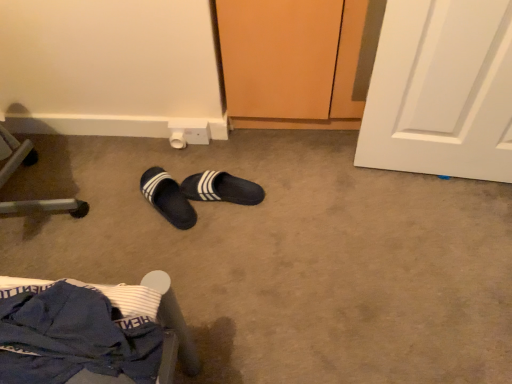
The width and height of the screenshot is (512, 384). Identify the location of blue fabric chair at lower left. (159, 320).

What do you see at coordinates (167, 198) in the screenshot? This screenshot has width=512, height=384. I see `black fuzzy slippers at center, the 2th footwear when ordered from right to left` at bounding box center [167, 198].

How much space does black fabric slippers at center, the 2th footwear in the left-to-right sequence, occupy horizontally?

12.10 inches.

I want to click on blue fabric chair at lower left, so click(159, 320).

Between blue fabric chair at lower left and black fuzzy slippers at center, which is counted as the first footwear, starting from the left, which one is positioned in front?

blue fabric chair at lower left is more forward.

Is blue fabric chair at lower left positioned with its back to black fuzzy slippers at center, the 2th footwear when ordered from right to left?

blue fabric chair at lower left does not have its back to black fuzzy slippers at center, the 2th footwear when ordered from right to left.

From the image's perspective, would you say blue fabric chair at lower left is shown under black fuzzy slippers at center, the 2th footwear when ordered from right to left?

Yes, from the image's perspective, blue fabric chair at lower left is beneath black fuzzy slippers at center, the 2th footwear when ordered from right to left.

From a real-world perspective, is blue fabric chair at lower left located higher than black fuzzy slippers at center, which is counted as the first footwear, starting from the left?

Yes, from a real-world perspective, blue fabric chair at lower left is above black fuzzy slippers at center, which is counted as the first footwear, starting from the left.

Could you measure the distance between blue fabric chair at lower left and black fabric slippers at center, the 1th footwear viewed from the right?

blue fabric chair at lower left and black fabric slippers at center, the 1th footwear viewed from the right, are 22.33 inches apart from each other.

Based on the photo, is blue fabric chair at lower left oriented away from black fabric slippers at center, the 2th footwear in the left-to-right sequence?

blue fabric chair at lower left does not have its back to black fabric slippers at center, the 2th footwear in the left-to-right sequence.

From a real-world perspective, which is physically below, blue fabric chair at lower left or black fabric slippers at center, the 2th footwear in the left-to-right sequence?

black fabric slippers at center, the 2th footwear in the left-to-right sequence, from a real-world perspective.

Would you say black fabric slippers at center, the 1th footwear viewed from the right, is inside or outside blue fabric chair at lower left?

black fabric slippers at center, the 1th footwear viewed from the right, exists outside the volume of blue fabric chair at lower left.

In terms of width, does black fabric slippers at center, the 2th footwear in the left-to-right sequence, look wider or thinner when compared to blue fabric chair at lower left?

Clearly, black fabric slippers at center, the 2th footwear in the left-to-right sequence, has less width compared to blue fabric chair at lower left.

From a real-world perspective, who is located lower, black fabric slippers at center, the 2th footwear in the left-to-right sequence, or blue fabric chair at lower left?

black fabric slippers at center, the 2th footwear in the left-to-right sequence, is physically lower.

Looking at this image, which is less distant, (207, 187) or (159, 169)?

Point (207, 187) is closer to the camera than point (159, 169).

Is black fabric slippers at center, the 2th footwear in the left-to-right sequence, inside the boundaries of black fuzzy slippers at center, which is counted as the first footwear, starting from the left, or outside?

black fabric slippers at center, the 2th footwear in the left-to-right sequence, lies outside black fuzzy slippers at center, which is counted as the first footwear, starting from the left.

Which object is positioned more to the right, black fabric slippers at center, the 2th footwear in the left-to-right sequence, or black fuzzy slippers at center, the 2th footwear when ordered from right to left?

black fabric slippers at center, the 2th footwear in the left-to-right sequence, is more to the right.

Is black fabric slippers at center, the 1th footwear viewed from the right, in contact with black fuzzy slippers at center, which is counted as the first footwear, starting from the left?

No, black fabric slippers at center, the 1th footwear viewed from the right, is not in contact with black fuzzy slippers at center, which is counted as the first footwear, starting from the left.

Is black fuzzy slippers at center, which is counted as the first footwear, starting from the left, aimed at black fabric slippers at center, the 2th footwear in the left-to-right sequence?

No, black fuzzy slippers at center, which is counted as the first footwear, starting from the left, does not turn towards black fabric slippers at center, the 2th footwear in the left-to-right sequence.

How many degrees apart are the facing directions of black fuzzy slippers at center, which is counted as the first footwear, starting from the left, and black fabric slippers at center, the 1th footwear viewed from the right?

They differ by 42.9 degrees in their facing directions.

Consider the image. Is black fuzzy slippers at center, the 2th footwear when ordered from right to left, outside of black fabric slippers at center, the 1th footwear viewed from the right?

Indeed, black fuzzy slippers at center, the 2th footwear when ordered from right to left, is completely outside black fabric slippers at center, the 1th footwear viewed from the right.

Measure the distance between black fuzzy slippers at center, which is counted as the first footwear, starting from the left, and black fabric slippers at center, the 1th footwear viewed from the right.

black fuzzy slippers at center, which is counted as the first footwear, starting from the left, is 4.05 inches from black fabric slippers at center, the 1th footwear viewed from the right.

Is point (166, 176) less distant than point (132, 319)?

No, (166, 176) is further to viewer.

Which object is more forward, black fuzzy slippers at center, which is counted as the first footwear, starting from the left, or blue fabric chair at lower left?

blue fabric chair at lower left is more forward.

Is black fuzzy slippers at center, the 2th footwear when ordered from right to left, shorter than blue fabric chair at lower left?

Yes.

From the image's perspective, is black fuzzy slippers at center, the 2th footwear when ordered from right to left, on top of blue fabric chair at lower left?

Yes, from the image's perspective, black fuzzy slippers at center, the 2th footwear when ordered from right to left, is over blue fabric chair at lower left.

Where is `the 1st footwear behind the blue fabric chair at lower left, counting from the anchor's position`? Image resolution: width=512 pixels, height=384 pixels. the 1st footwear behind the blue fabric chair at lower left, counting from the anchor's position is located at coordinates (167, 198).

Where is `footwear that is the 2nd one when counting upward from the blue fabric chair at lower left (from the image's perspective)`? This screenshot has width=512, height=384. footwear that is the 2nd one when counting upward from the blue fabric chair at lower left (from the image's perspective) is located at coordinates (221, 188).

From the image, which object appears to be nearer to blue fabric chair at lower left, black fabric slippers at center, the 1th footwear viewed from the right, or black fuzzy slippers at center, the 2th footwear when ordered from right to left?

Based on the image, black fuzzy slippers at center, the 2th footwear when ordered from right to left, appears to be nearer to blue fabric chair at lower left.

From the image, which object appears to be nearer to black fabric slippers at center, the 1th footwear viewed from the right, black fuzzy slippers at center, the 2th footwear when ordered from right to left, or blue fabric chair at lower left?

Based on the image, black fuzzy slippers at center, the 2th footwear when ordered from right to left, appears to be nearer to black fabric slippers at center, the 1th footwear viewed from the right.

Estimate the real-world distances between objects in this image. Which object is further from black fuzzy slippers at center, which is counted as the first footwear, starting from the left, blue fabric chair at lower left or black fabric slippers at center, the 2th footwear in the left-to-right sequence?

blue fabric chair at lower left.

Estimate the real-world distances between objects in this image. Which object is closer to black fabric slippers at center, the 2th footwear in the left-to-right sequence, blue fabric chair at lower left or black fuzzy slippers at center, which is counted as the first footwear, starting from the left?

black fuzzy slippers at center, which is counted as the first footwear, starting from the left, lies closer to black fabric slippers at center, the 2th footwear in the left-to-right sequence, than the other object.

From the image, which object appears to be nearer to black fuzzy slippers at center, which is counted as the first footwear, starting from the left, black fabric slippers at center, the 1th footwear viewed from the right, or blue fabric chair at lower left?

Based on the image, black fabric slippers at center, the 1th footwear viewed from the right, appears to be nearer to black fuzzy slippers at center, which is counted as the first footwear, starting from the left.

From the picture: Which object lies further to the anchor point blue fabric chair at lower left, black fuzzy slippers at center, which is counted as the first footwear, starting from the left, or black fabric slippers at center, the 1th footwear viewed from the right?

Among the two, black fabric slippers at center, the 1th footwear viewed from the right, is located further to blue fabric chair at lower left.

Image resolution: width=512 pixels, height=384 pixels. I want to click on footwear between blue fabric chair at lower left and black fabric slippers at center, the 2th footwear in the left-to-right sequence, along the z-axis, so click(x=167, y=198).